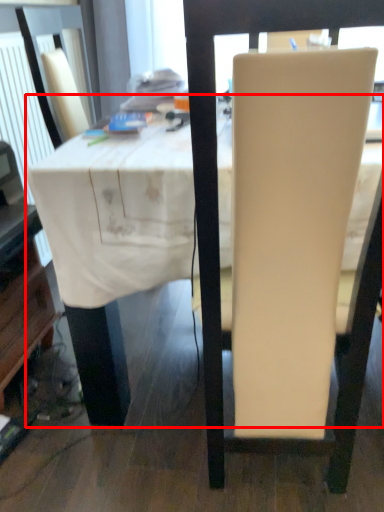
Question: From the image's perspective, where is table (annotated by the red box) located in relation to chair in the image?

Choices:
 (A) below
 (B) above

Answer: (B)